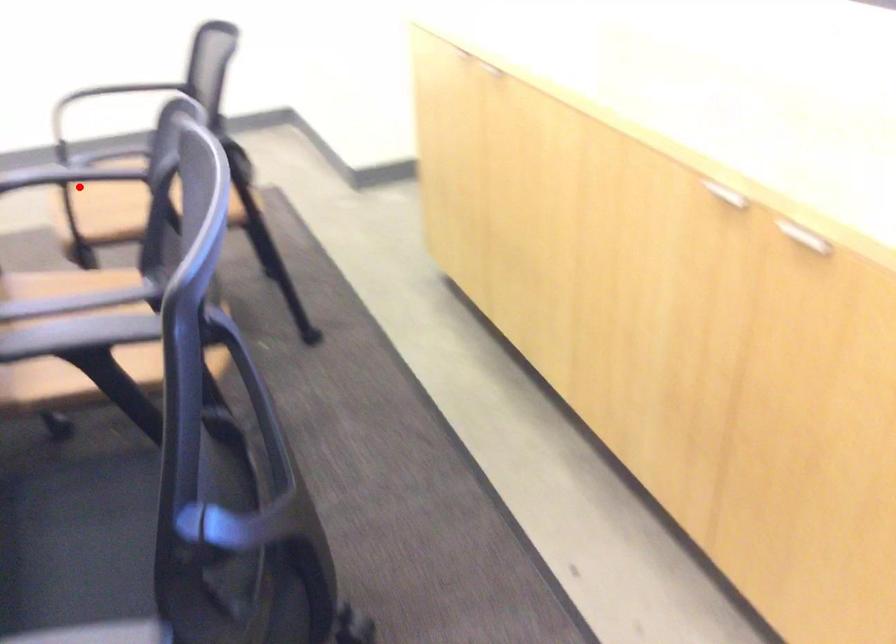
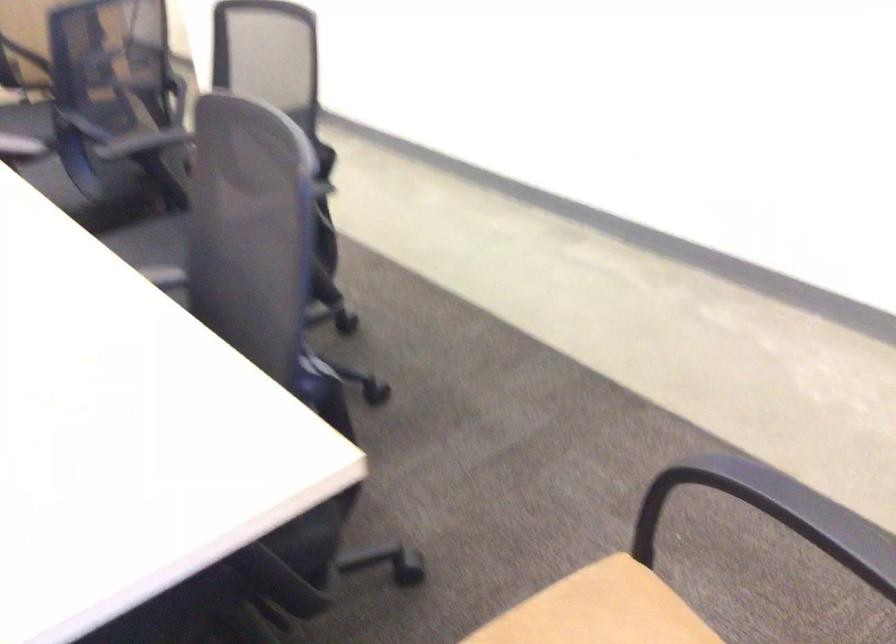
Question: I am providing you with two images of the same scene from different viewpoints. A red point is marked on the first image. Can you still see the location of the red point in image 2?

Choices:
 (A) Yes
 (B) No

Answer: (A)